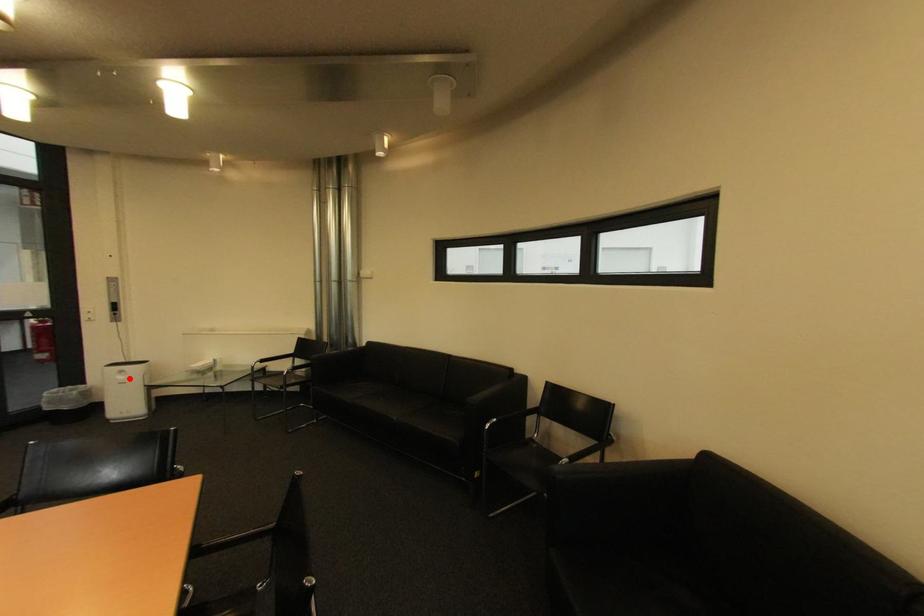
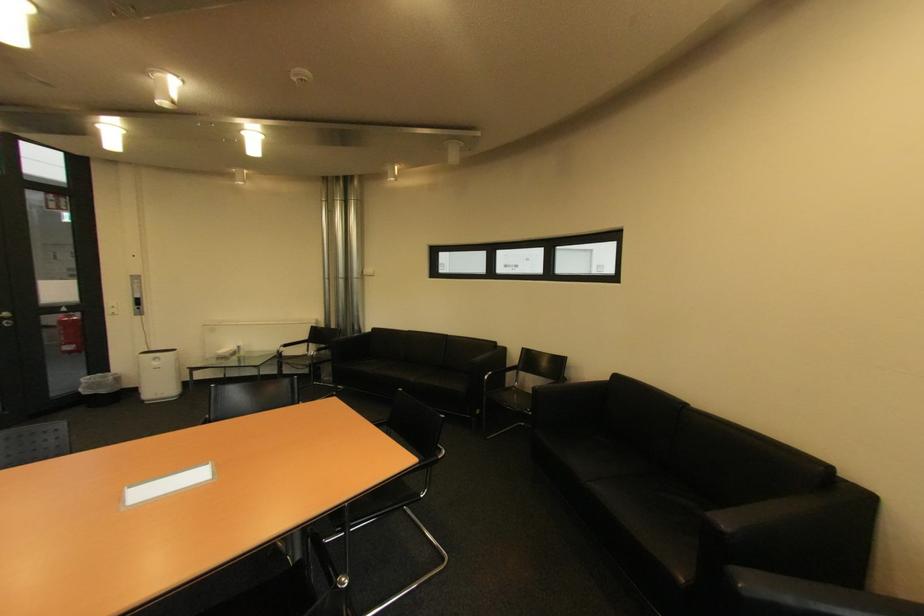
Question: A red point is marked in image1. In image2, is the corresponding 3D point closer to the camera or farther? Reply with the corresponding letter.

Choices:
 (A) The corresponding 3D point is closer.
 (B) The corresponding 3D point is farther.

Answer: (B)